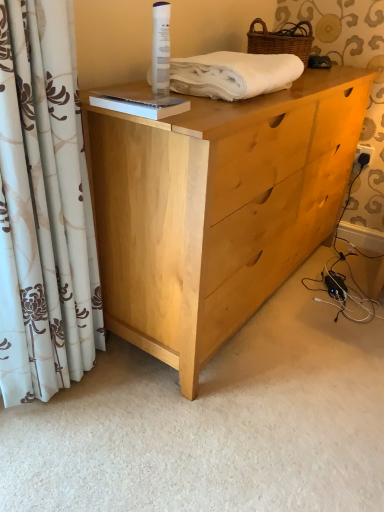
Question: From the image's perspective, is white floral curtain at left located above or below white cotton towel at upper center?

Choices:
 (A) below
 (B) above

Answer: (A)

Question: Is white floral curtain at left inside the boundaries of white cotton towel at upper center, or outside?

Choices:
 (A) inside
 (B) outside

Answer: (B)

Question: Considering the real-world distances, which object is farthest from the woven brown basket at upper right?

Choices:
 (A) white cotton towel at upper center
 (B) white floral curtain at left
 (C) light wood dresser at center

Answer: (B)

Question: Estimate the real-world distances between objects in this image. Which object is farther from the white cotton towel at upper center?

Choices:
 (A) light wood dresser at center
 (B) white floral curtain at left
 (C) woven brown basket at upper right

Answer: (B)